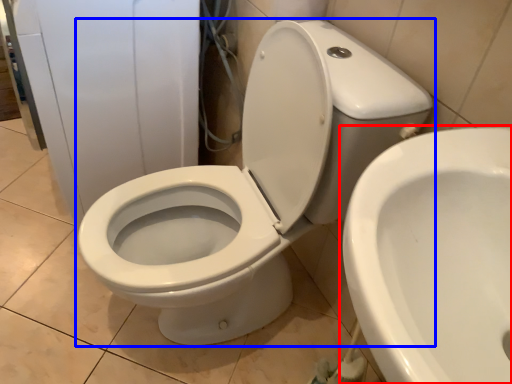
Question: Which object appears closest to the camera in this image, toilet (highlighted by a red box) or toilet (highlighted by a blue box)?

Choices:
 (A) toilet
 (B) toilet

Answer: (A)